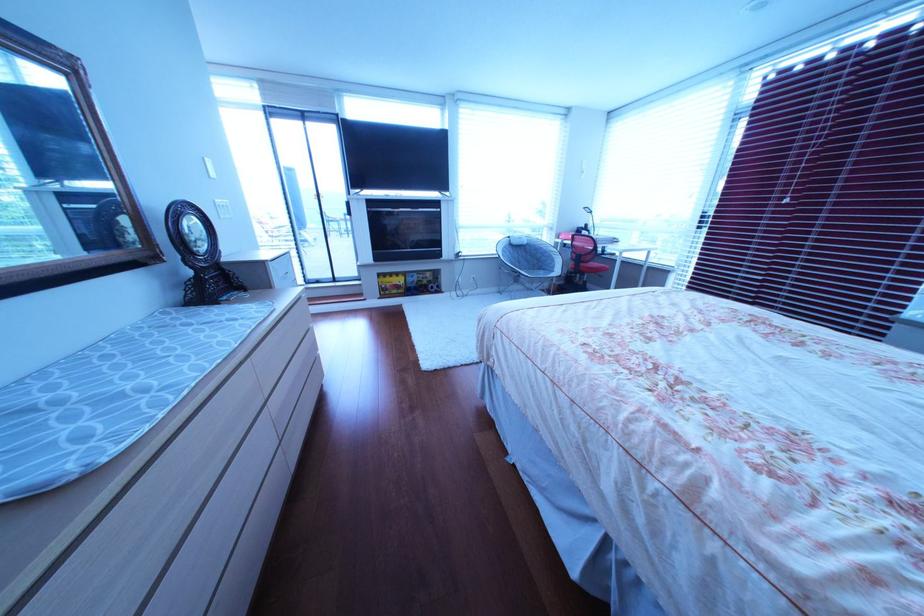
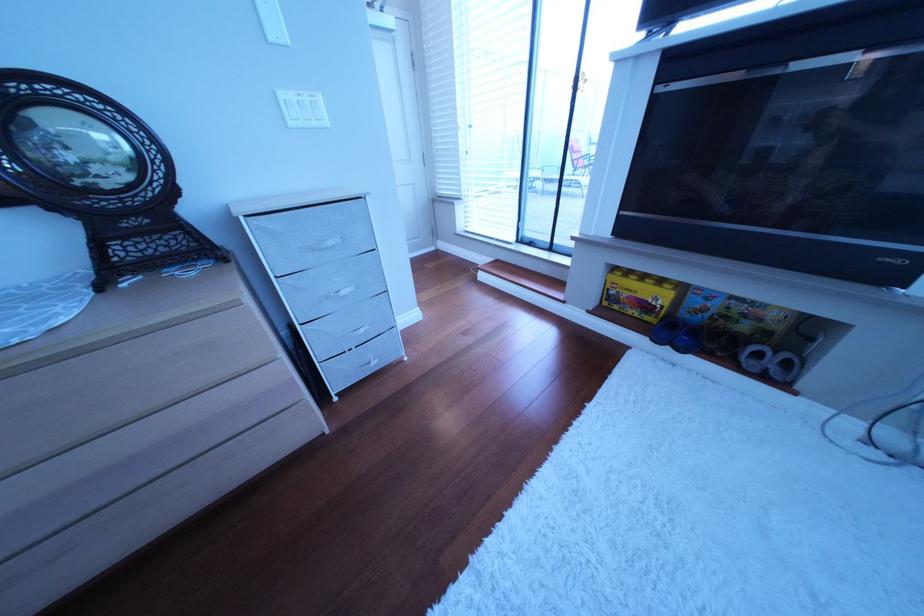
Find the pixel in the second image that matches (x=419, y=292) in the first image.

(672, 320)